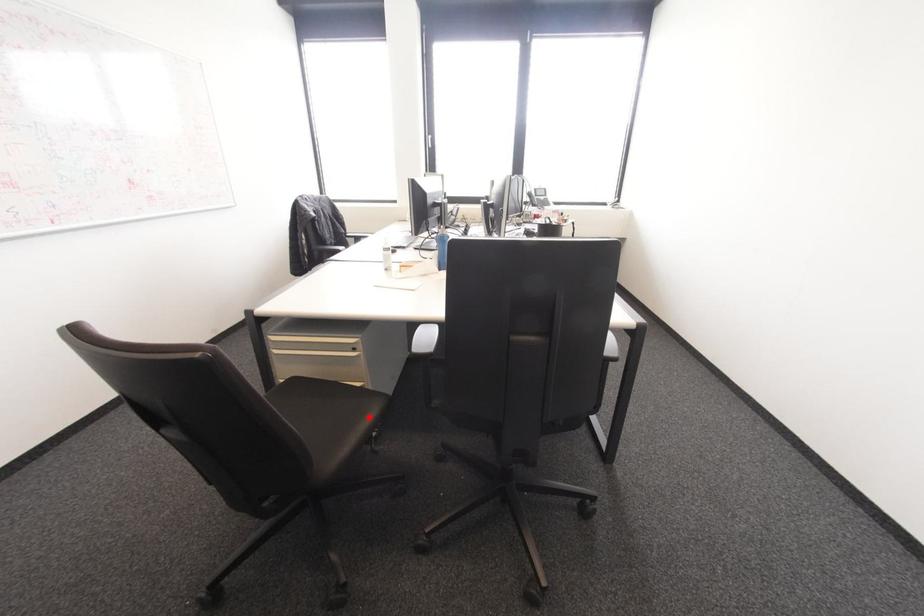
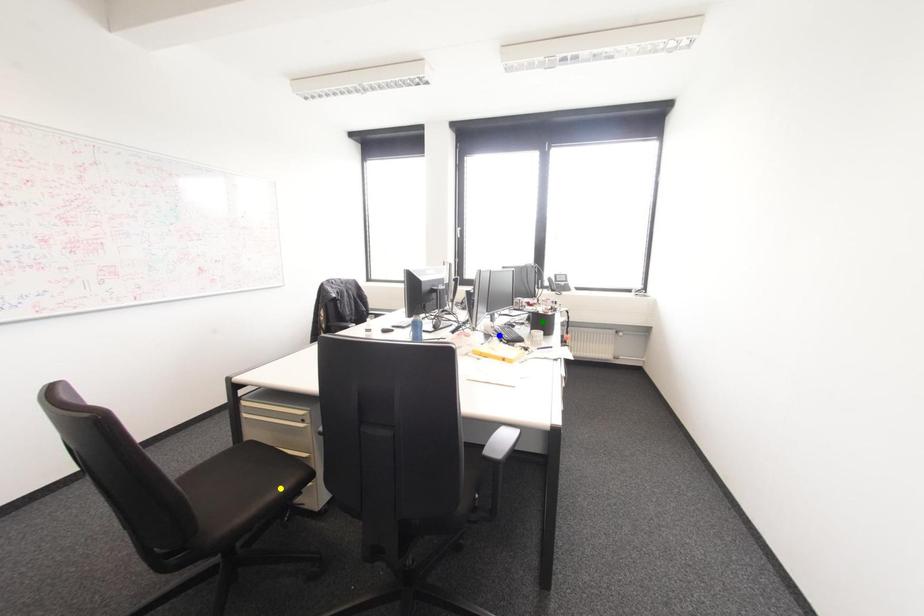
Question: I am providing you with two images of the same scene from different viewpoints. A red point is marked on the first image. You are given multiple points on the second image. In image 2, which mark is for the same physical point as the one in image 1?

Choices:
 (A) green point
 (B) blue point
 (C) yellow point

Answer: (C)